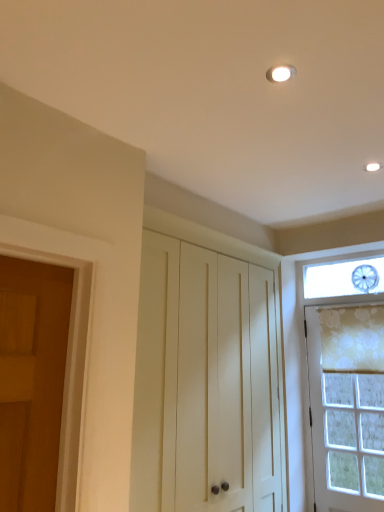
Question: Is white textured door at right to the left of floral fabric curtain at right from the viewer's perspective?

Choices:
 (A) no
 (B) yes

Answer: (B)

Question: Would you say white textured door at right contains floral fabric curtain at right?

Choices:
 (A) no
 (B) yes

Answer: (B)

Question: Is white textured door at right oriented away from floral fabric curtain at right?

Choices:
 (A) no
 (B) yes

Answer: (B)

Question: Is white textured door at right oriented towards floral fabric curtain at right?

Choices:
 (A) no
 (B) yes

Answer: (B)

Question: Is white textured door at right bigger than floral fabric curtain at right?

Choices:
 (A) no
 (B) yes

Answer: (B)

Question: Is white textured door at right completely or partially outside of floral fabric curtain at right?

Choices:
 (A) no
 (B) yes

Answer: (B)

Question: From a real-world perspective, is white wood cabinet at center below floral fabric curtain at right?

Choices:
 (A) yes
 (B) no

Answer: (A)

Question: Considering the relative sizes of white wood cabinet at center and floral fabric curtain at right in the image provided, is white wood cabinet at center thinner than floral fabric curtain at right?

Choices:
 (A) no
 (B) yes

Answer: (A)

Question: Does white wood cabinet at center turn towards floral fabric curtain at right?

Choices:
 (A) yes
 (B) no

Answer: (A)

Question: Is the surface of white wood cabinet at center in direct contact with floral fabric curtain at right?

Choices:
 (A) yes
 (B) no

Answer: (B)

Question: Does white wood cabinet at center have a smaller size compared to floral fabric curtain at right?

Choices:
 (A) yes
 (B) no

Answer: (B)

Question: Does white wood cabinet at center have a greater width compared to floral fabric curtain at right?

Choices:
 (A) no
 (B) yes

Answer: (B)

Question: Considering the relative sizes of floral fabric curtain at right and white wood cabinet at center in the image provided, is floral fabric curtain at right smaller than white wood cabinet at center?

Choices:
 (A) yes
 (B) no

Answer: (A)